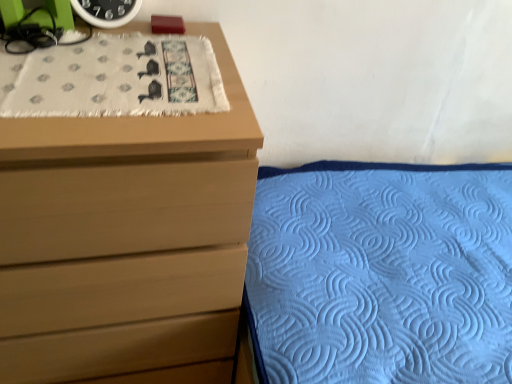
Question: Does matte wood chest of drawers at upper left have a lesser height compared to white textured cloth at upper left?

Choices:
 (A) no
 (B) yes

Answer: (A)

Question: Is matte wood chest of drawers at upper left not within white textured cloth at upper left?

Choices:
 (A) no
 (B) yes

Answer: (B)

Question: Is matte wood chest of drawers at upper left behind white textured cloth at upper left?

Choices:
 (A) no
 (B) yes

Answer: (A)

Question: From the image's perspective, would you say matte wood chest of drawers at upper left is shown under white textured cloth at upper left?

Choices:
 (A) yes
 (B) no

Answer: (A)

Question: Considering the relative sizes of matte wood chest of drawers at upper left and white textured cloth at upper left in the image provided, is matte wood chest of drawers at upper left wider than white textured cloth at upper left?

Choices:
 (A) yes
 (B) no

Answer: (A)

Question: Does matte wood chest of drawers at upper left have a larger size compared to white textured cloth at upper left?

Choices:
 (A) yes
 (B) no

Answer: (A)

Question: Can you confirm if green matte clock at upper left is positioned to the right of blue quilted fabric at lower right?

Choices:
 (A) yes
 (B) no

Answer: (B)

Question: Is green matte clock at upper left not near blue quilted fabric at lower right?

Choices:
 (A) yes
 (B) no

Answer: (B)

Question: Is green matte clock at upper left positioned with its back to blue quilted fabric at lower right?

Choices:
 (A) no
 (B) yes

Answer: (A)

Question: From the image's perspective, would you say green matte clock at upper left is positioned over blue quilted fabric at lower right?

Choices:
 (A) no
 (B) yes

Answer: (B)

Question: Does green matte clock at upper left have a lesser width compared to blue quilted fabric at lower right?

Choices:
 (A) no
 (B) yes

Answer: (B)

Question: From the image's perspective, does green matte clock at upper left appear lower than blue quilted fabric at lower right?

Choices:
 (A) no
 (B) yes

Answer: (A)

Question: Is white textured cloth at upper left positioned in front of green matte clock at upper left?

Choices:
 (A) yes
 (B) no

Answer: (A)